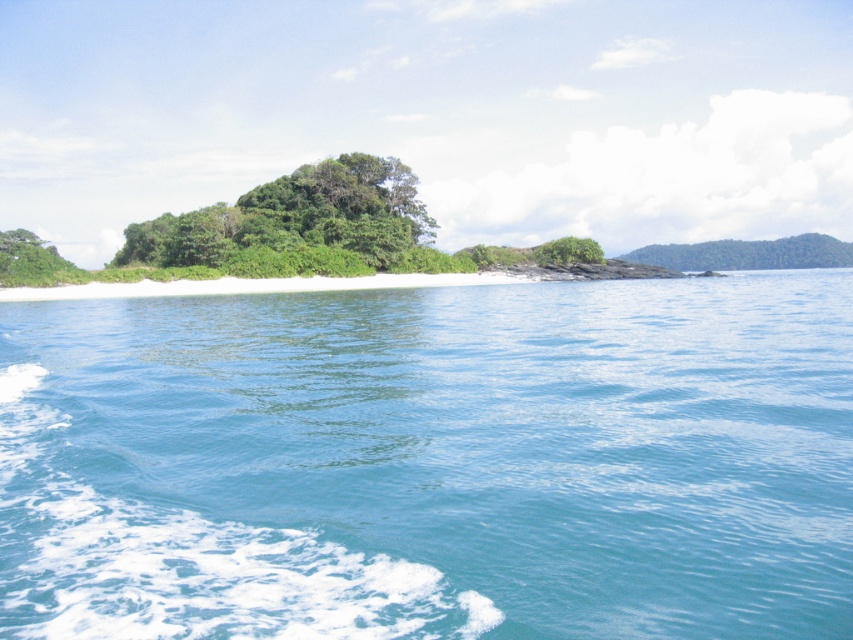
Question: Can you confirm if clear blue water at center is thinner than green leafy bush at center?

Choices:
 (A) no
 (B) yes

Answer: (A)

Question: Can you confirm if clear blue water at center is smaller than green leafy bush at center?

Choices:
 (A) yes
 (B) no

Answer: (B)

Question: Which of the following is the closest to the observer?

Choices:
 (A) clear blue water at center
 (B) green leafy bush at center

Answer: (A)

Question: Among these points, which one is nearest to the camera?

Choices:
 (A) click(689, 536)
 (B) click(558, 259)

Answer: (A)

Question: Which point is farther from the camera taking this photo?

Choices:
 (A) (546, 259)
 (B) (698, 474)

Answer: (A)

Question: Is clear blue water at center further to camera compared to green leafy bush at center?

Choices:
 (A) yes
 (B) no

Answer: (B)